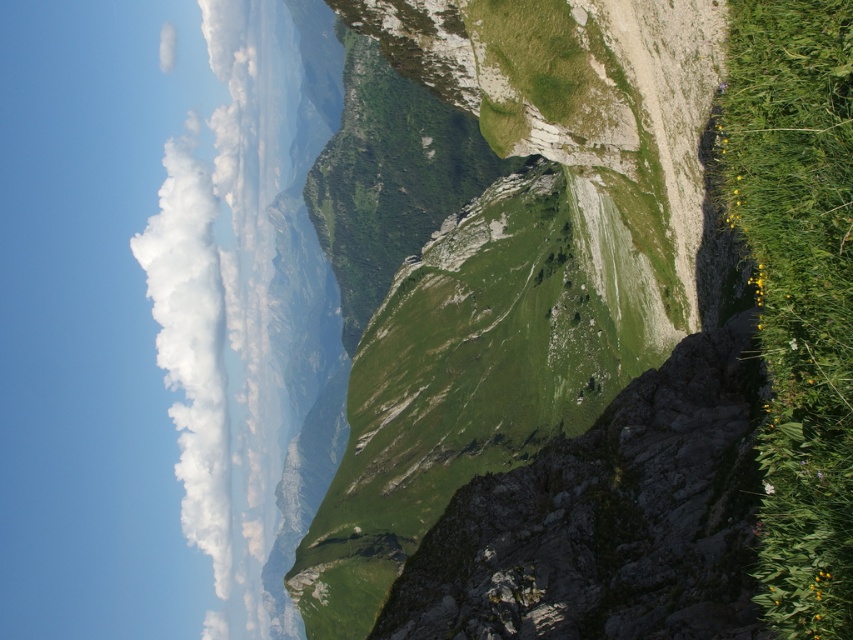
You are a hiker planning to traverse the green grassy hillside at center and the white fluffy cloud at upper left. Which object is located to the right side of the other?

The green grassy hillside at center is to the right of the white fluffy cloud at upper left.

You are a hiker planning to traverse the green grassy hillside at center. Based on the coordinates provided, can you determine if the hillside is positioned centrally within the image?

The green grassy hillside at center is located at coordinates point (503, 257), which is very close to the center of the image, so it is positioned centrally within the image.